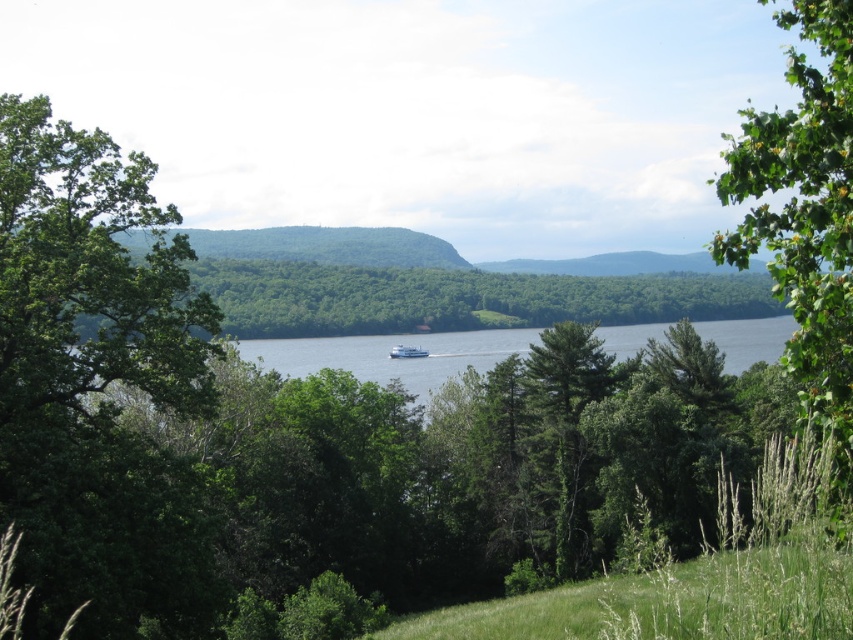
Measure the distance from green leafy tree at left to clear blue water at center.

green leafy tree at left and clear blue water at center are 175.77 feet apart.

Can you confirm if green leafy tree at left is smaller than clear blue water at center?

Indeed, green leafy tree at left has a smaller size compared to clear blue water at center.

Which is in front, point (189, 573) or point (445, 371)?

Point (189, 573) is in front.

This screenshot has height=640, width=853. In order to click on green leafy tree at left in this screenshot , I will do `click(97, 385)`.

Is green leafy tree at right to the right of clear blue water at center from the viewer's perspective?

Yes, green leafy tree at right is to the right of clear blue water at center.

The width and height of the screenshot is (853, 640). Identify the location of green leafy tree at right. (805, 220).

The image size is (853, 640). Identify the location of green leafy tree at right. (805, 220).

The image size is (853, 640). Find the location of `green leafy tree at right`. green leafy tree at right is located at coordinates (805, 220).

Does green leafy tree at right have a larger size compared to white glossy boat at center?

Yes, green leafy tree at right is bigger than white glossy boat at center.

What do you see at coordinates (805, 220) in the screenshot?
I see `green leafy tree at right` at bounding box center [805, 220].

Locate an element on the screen. green leafy tree at right is located at coordinates (805, 220).